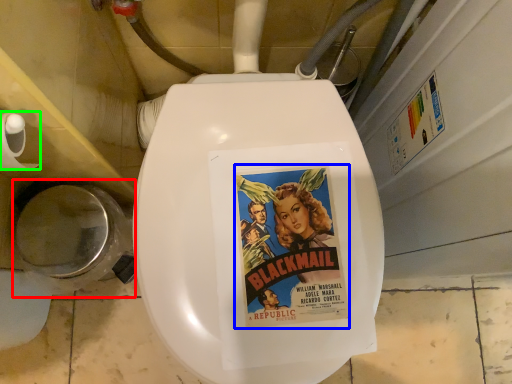
Question: Which object is the closest to the toilet bowl (highlighted by a red box)? Choose among these: fiction book (highlighted by a blue box) or toilet paper (highlighted by a green box).

Choices:
 (A) fiction book
 (B) toilet paper

Answer: (B)